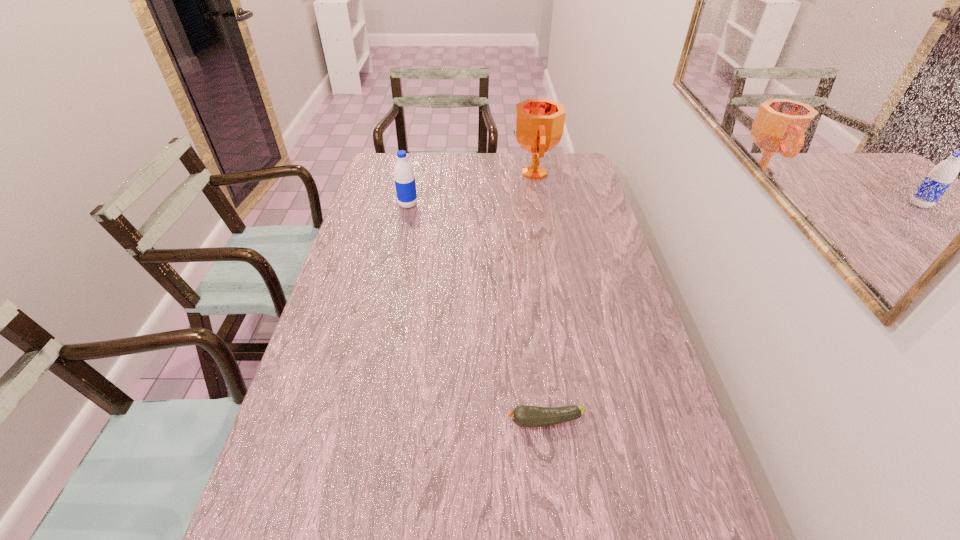
You are a GUI agent. You are given a task and a screenshot of the screen. Output one action in this format:
    pyautogui.click(x=<x>, y=<y>)
    Task: Click on the free point between the leftmost object and the zucchini
    Image resolution: width=960 pixels, height=540 pixels.
    Given the screenshot: What is the action you would take?
    pyautogui.click(x=476, y=313)

This screenshot has width=960, height=540. Identify the location of object that is the closest to the nearest object. (405, 185).

Identify the location of object that stands as the second closest to the zucchini. Image resolution: width=960 pixels, height=540 pixels. (538, 127).

What are the coordinates of `vacant area that satisfies the following two spatial constraints: 1. on the side of the farthest object with the star emblem; 2. on the front side of the second tallest object` in the screenshot? It's located at (539, 205).